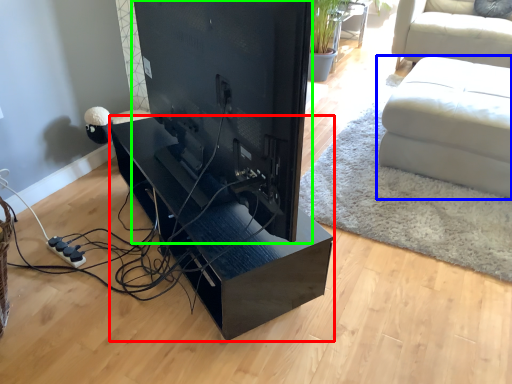
Question: Based on their relative distances, which object is farther from table (highlighted by a red box)? Choose from studio couch (highlighted by a blue box) and desktop computer (highlighted by a green box).

Choices:
 (A) studio couch
 (B) desktop computer

Answer: (A)